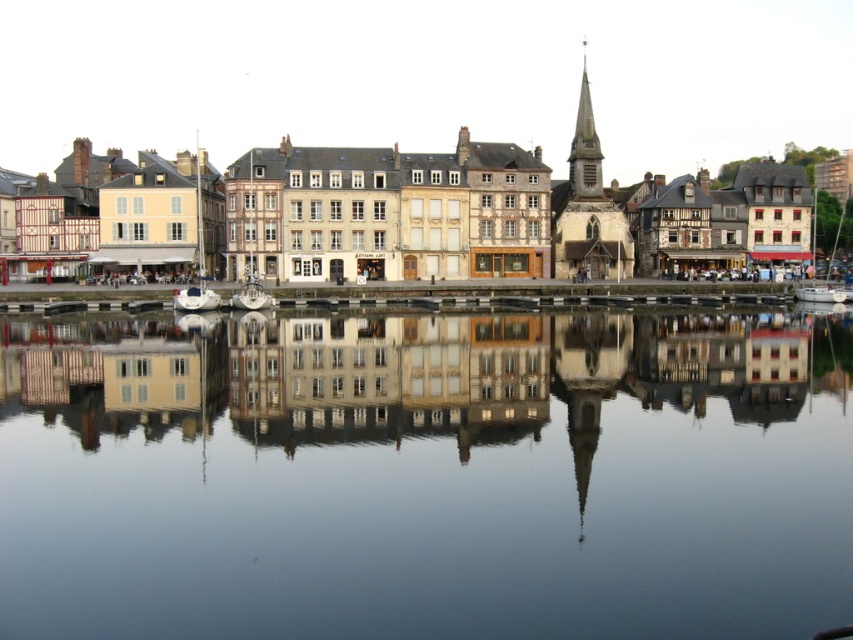
Question: Which object is closer to the camera taking this photo?

Choices:
 (A) white wooden sailboat at center
 (B) white concrete dock at center

Answer: (B)

Question: Which object is the closest to the wooden timber buildings at center?

Choices:
 (A) white matte boat at left
 (B) smooth reflective water at center

Answer: (A)

Question: Among these points, which one is farthest from the camera?

Choices:
 (A) (808, 145)
 (B) (590, 132)
 (C) (194, 285)
 (D) (802, 296)

Answer: (A)

Question: Does smooth reflective water at center appear on the left side of white concrete dock at center?

Choices:
 (A) yes
 (B) no

Answer: (A)

Question: Is wooden timber buildings at center above white wooden sailboat at center?

Choices:
 (A) no
 (B) yes

Answer: (B)

Question: Does gray stone spire at upper right appear under white glossy boat at center?

Choices:
 (A) no
 (B) yes

Answer: (A)